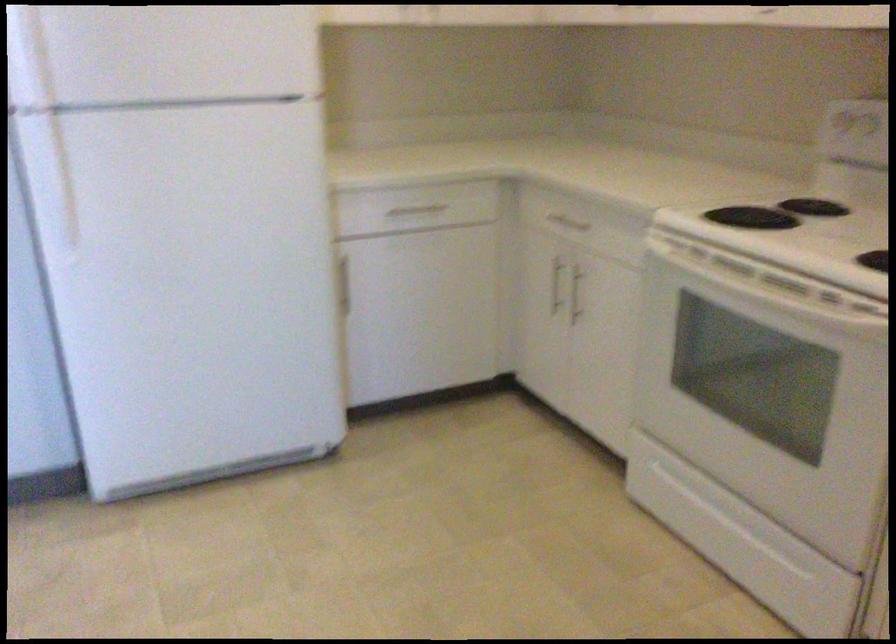
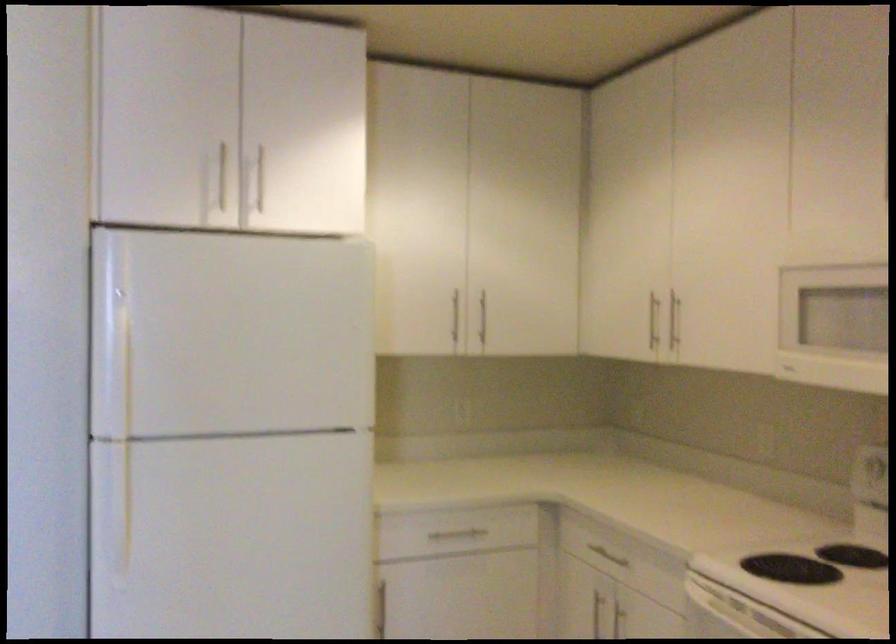
Question: In a continuous first-person perspective shot, in which direction is the camera moving?

Choices:
 (A) Left
 (B) Right
 (C) Forward
 (D) Backward

Answer: (D)